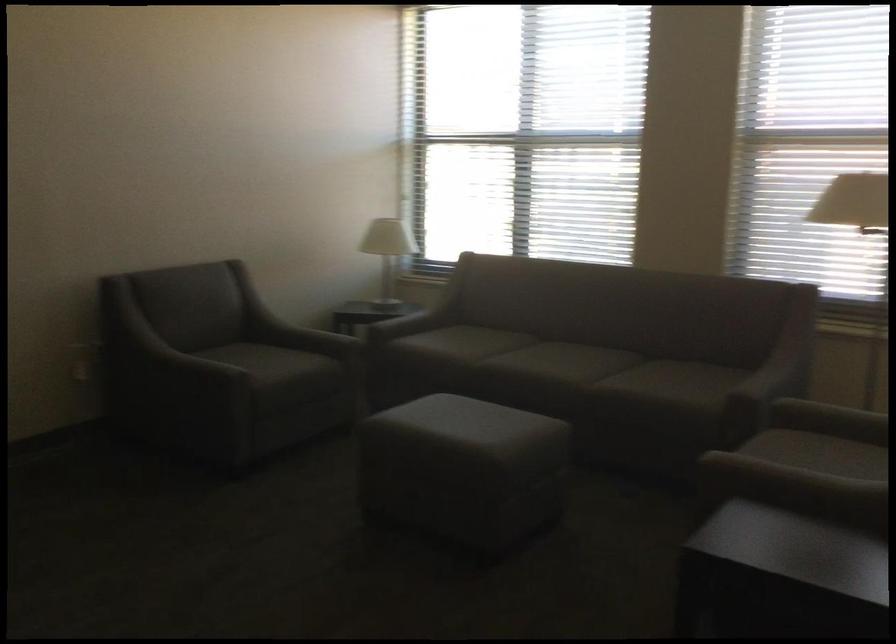
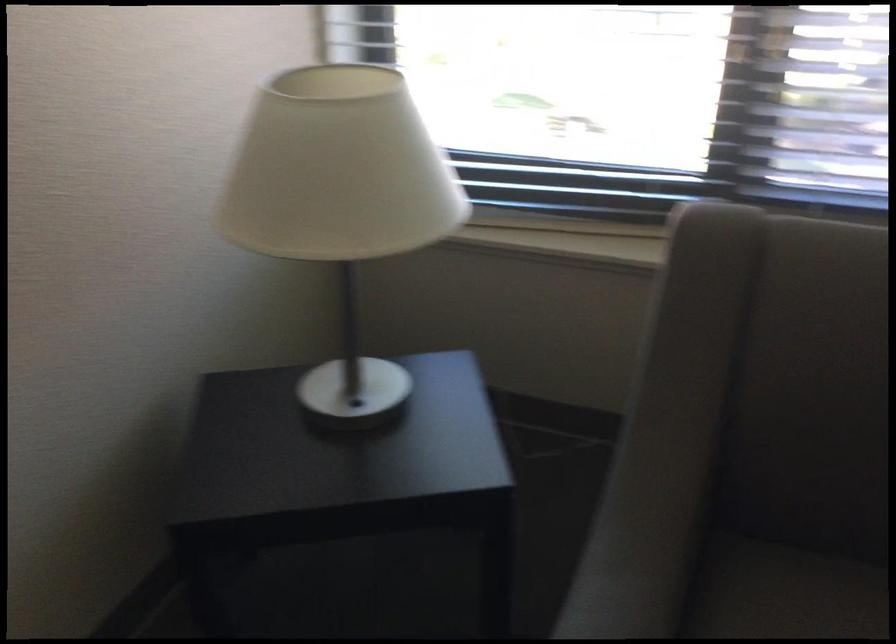
Question: The images are taken continuously from a first-person perspective. In which direction are you moving?

Choices:
 (A) Left
 (B) Right
 (C) Forward
 (D) Backward

Answer: (C)